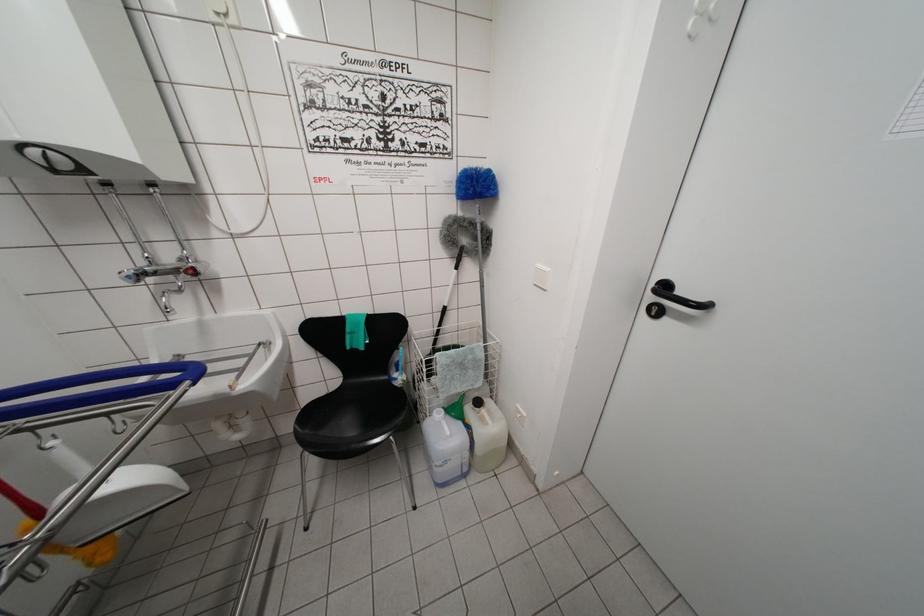
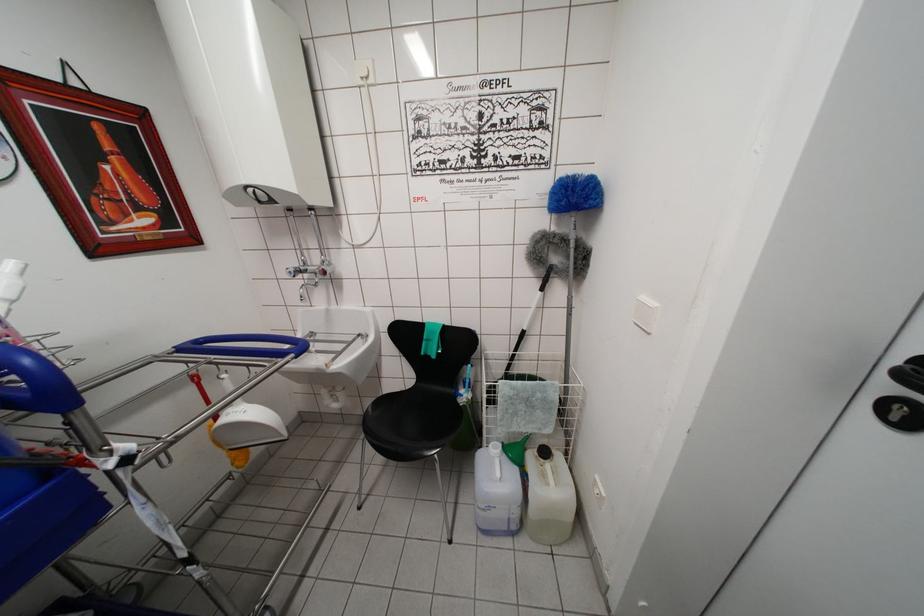
In the second image, find the point that corresponds to point (438, 418) in the first image.

(493, 450)